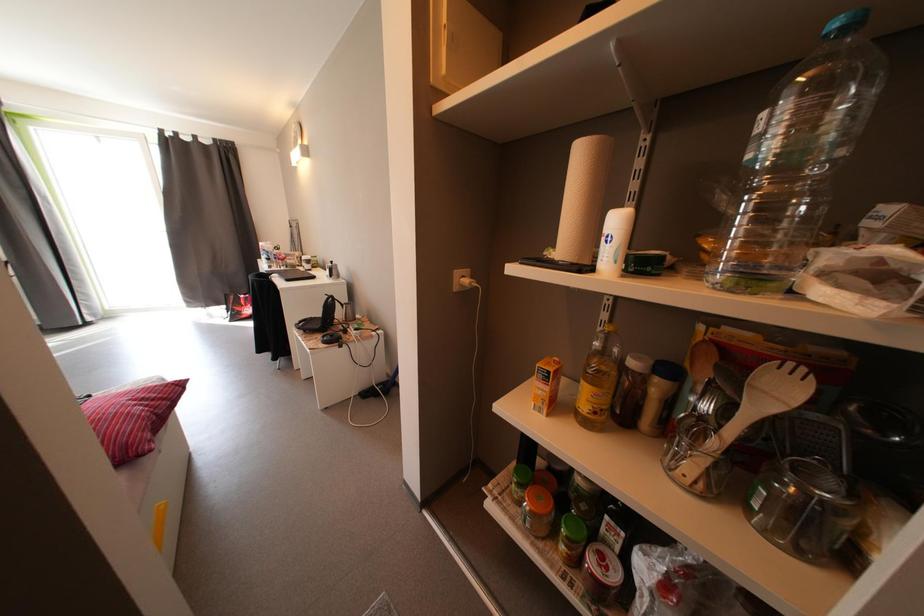
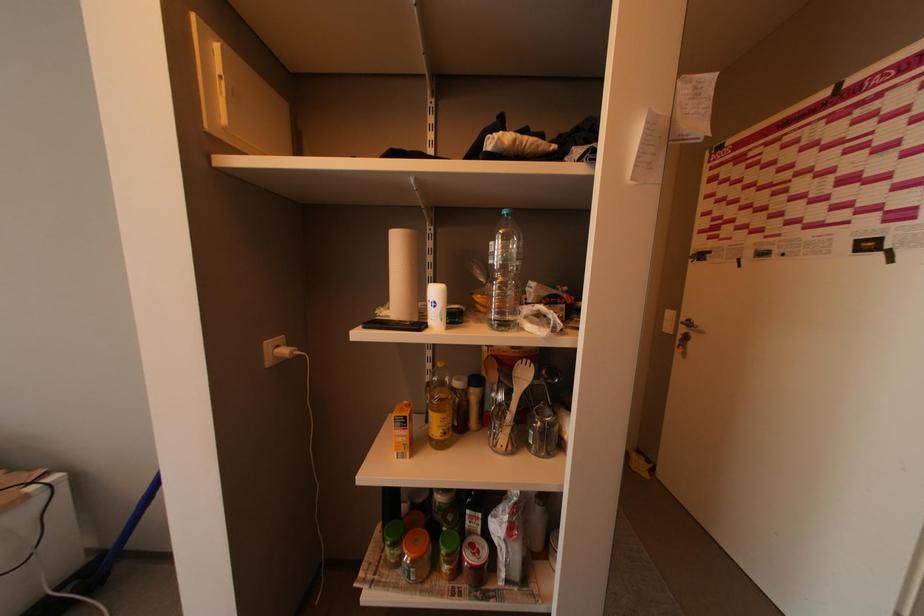
Question: The images are taken continuously from a first-person perspective. In which direction is your viewpoint rotating?

Choices:
 (A) Left
 (B) Right
 (C) Up
 (D) Down

Answer: (B)